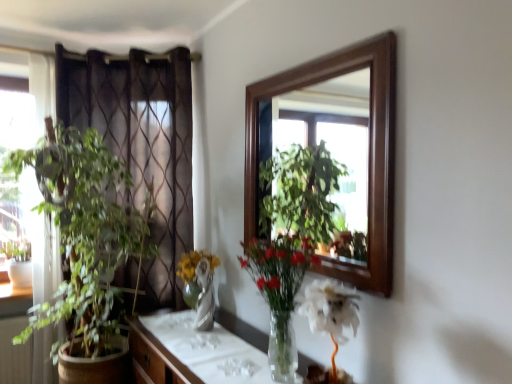
Question: Is brown sheer curtain at left inside the boundaries of green leafy plant at left, the first houseplant when ordered from back to front, or outside?

Choices:
 (A) inside
 (B) outside

Answer: (B)

Question: In terms of size, does brown sheer curtain at left appear bigger or smaller than green leafy plant at left, which is the 2th houseplant in front-to-back order?

Choices:
 (A) big
 (B) small

Answer: (B)

Question: Based on their relative distances, which object is nearer to the brown sheer curtain at left?

Choices:
 (A) translucent glass vase at center, marked as the 1th houseplant in a right-to-left arrangement
 (B) wooden cabinet at center
 (C) green leafy plant at left, acting as the 1th houseplant starting from the left

Answer: (C)

Question: Which is farther from the brown sheer curtain at left?

Choices:
 (A) wooden cabinet at center
 (B) green leafy plant at left, the second houseplant when ordered from right to left
 (C) translucent glass vase at center, positioned as the first houseplant in front-to-back order

Answer: (C)